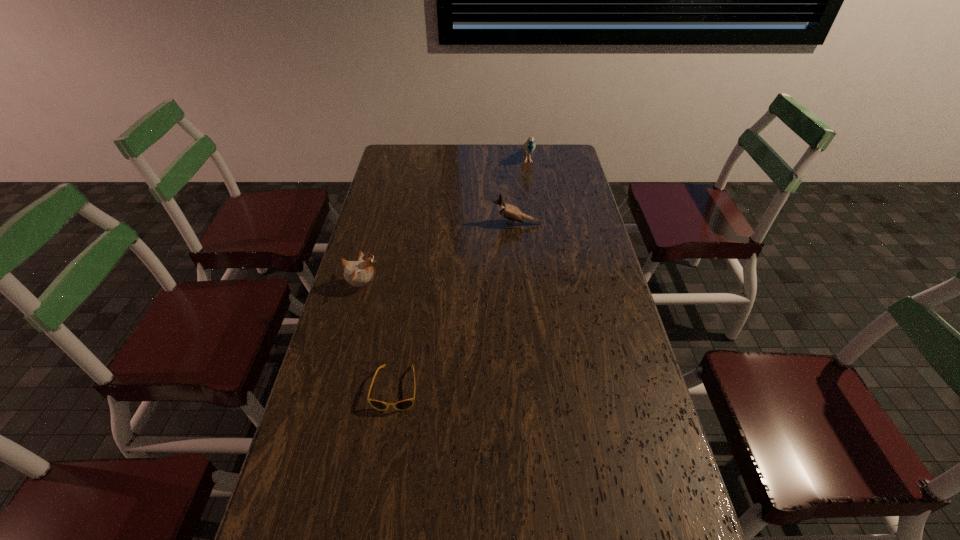
Select which object is the closest to the farthest bird. Please provide its 2D coordinates. Your answer should be formatted as a tuple, i.e. [(x, y)], where the tuple contains the x and y coordinates of a point satisfying the conditions above.

[(509, 212)]

Where is `bird that stands as the second closest to the leftmost object`? The width and height of the screenshot is (960, 540). bird that stands as the second closest to the leftmost object is located at coordinates (529, 146).

Select which bird appears as the second closest to the second farthest bird. Please provide its 2D coordinates. Your answer should be formatted as a tuple, i.e. [(x, y)], where the tuple contains the x and y coordinates of a point satisfying the conditions above.

[(357, 273)]

This screenshot has height=540, width=960. I want to click on vacant space that satisfies the following two spatial constraints: 1. at the face of the farthest bird; 2. at the beak of the second nearest object, so click(547, 286).

You are a GUI agent. You are given a task and a screenshot of the screen. Output one action in this format:
    pyautogui.click(x=<x>, y=<y>)
    Task: Click on the vacant point that satisfies the following two spatial constraints: 1. at the face of the second farthest object; 2. on the front-facing side of the nearest object
    This screenshot has height=540, width=960.
    Given the screenshot: What is the action you would take?
    [535, 388]

This screenshot has width=960, height=540. Find the location of `free location that satisfies the following two spatial constraints: 1. at the face of the farthest bird; 2. at the face of the second farthest object`. free location that satisfies the following two spatial constraints: 1. at the face of the farthest bird; 2. at the face of the second farthest object is located at coordinates (538, 224).

Image resolution: width=960 pixels, height=540 pixels. I want to click on free location that satisfies the following two spatial constraints: 1. at the face of the second farthest object; 2. on the front-facing side of the sunglasses, so click(x=535, y=388).